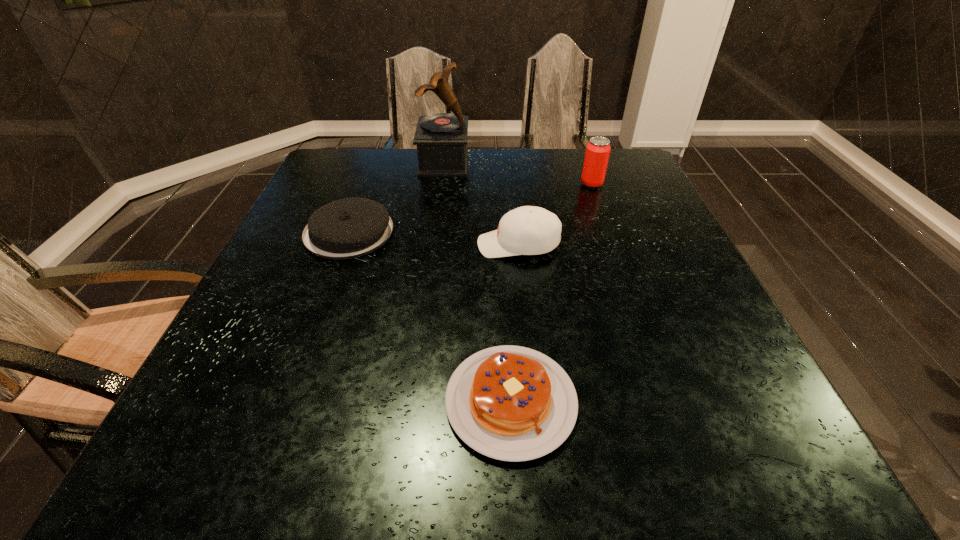
Find the location of `empty space between the shortest object and the leftmost object`. empty space between the shortest object and the leftmost object is located at coordinates (430, 316).

At what (x,y) coordinates should I click in order to perform the action: click on vacant region between the rightmost object and the baseball cap. Please return your answer as a coordinate pair (x, y). This screenshot has height=540, width=960. Looking at the image, I should click on pos(555,214).

Locate an element on the screen. The width and height of the screenshot is (960, 540). blank region between the third shortest object and the left pancake is located at coordinates (434, 239).

This screenshot has width=960, height=540. In order to click on free space between the farthest object and the third shortest object in this screenshot , I will do click(481, 204).

The width and height of the screenshot is (960, 540). I want to click on free space between the shorter pancake and the second farthest object, so click(x=551, y=293).

Locate an element on the screen. The image size is (960, 540). free space that is in between the shorter pancake and the baseball cap is located at coordinates (515, 323).

You are a GUI agent. You are given a task and a screenshot of the screen. Output one action in this format:
    pyautogui.click(x=<x>, y=<y>)
    Task: Click on the free spot between the farthest object and the shortest object
    This screenshot has height=540, width=960.
    Given the screenshot: What is the action you would take?
    pyautogui.click(x=477, y=282)

You are a GUI agent. You are given a task and a screenshot of the screen. Output one action in this format:
    pyautogui.click(x=<x>, y=<y>)
    Task: Click on the object that ranks as the third closest to the leftmost object
    The width and height of the screenshot is (960, 540).
    Given the screenshot: What is the action you would take?
    pyautogui.click(x=511, y=403)

What are the coordinates of `the third closest object to the nearer pancake` in the screenshot? It's located at (598, 149).

At what (x,y) coordinates should I click in order to perform the action: click on free region that satisfies the following two spatial constraints: 1. on the back side of the rightmost object; 2. on the right side of the shortest object. Please return your answer as a coordinate pair (x, y). Looking at the image, I should click on (498, 184).